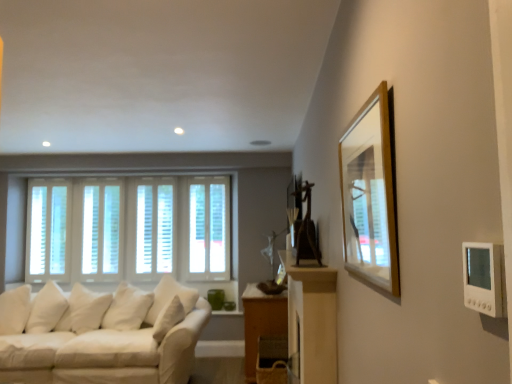
Question: In which direction should I rotate to look at white wood window at center, acting as the 3th window starting from the right?

Choices:
 (A) left
 (B) right

Answer: (A)

Question: Is white fabric couch at lower left touching white wood blinds at center, marked as the second window in a right-to-left arrangement?

Choices:
 (A) no
 (B) yes

Answer: (A)

Question: Is white fabric couch at lower left bigger than white wood blinds at center, placed as the third window when sorted from left to right?

Choices:
 (A) yes
 (B) no

Answer: (A)

Question: Can you confirm if white fabric couch at lower left is smaller than white wood blinds at center, placed as the third window when sorted from left to right?

Choices:
 (A) yes
 (B) no

Answer: (B)

Question: Is white fabric couch at lower left thinner than white wood blinds at center, placed as the third window when sorted from left to right?

Choices:
 (A) no
 (B) yes

Answer: (A)

Question: Considering the relative sizes of white fabric couch at lower left and white wood blinds at center, marked as the second window in a right-to-left arrangement, in the image provided, is white fabric couch at lower left wider than white wood blinds at center, marked as the second window in a right-to-left arrangement,?

Choices:
 (A) yes
 (B) no

Answer: (A)

Question: Would you say white fabric couch at lower left is a long distance from white wood blinds at center, marked as the second window in a right-to-left arrangement?

Choices:
 (A) yes
 (B) no

Answer: (A)

Question: Does white wood blinds at left, positioned as the first window in left-to-right order, appear on the left side of wooden table at lower center?

Choices:
 (A) yes
 (B) no

Answer: (A)

Question: Is white wood blinds at left, positioned as the first window in left-to-right order, further to camera compared to wooden table at lower center?

Choices:
 (A) no
 (B) yes

Answer: (B)

Question: Is white wood blinds at left, positioned as the first window in left-to-right order, aimed at wooden table at lower center?

Choices:
 (A) yes
 (B) no

Answer: (B)

Question: Is the depth of white wood blinds at left, which appears as the 4th window when viewed from the right, less than that of wooden table at lower center?

Choices:
 (A) yes
 (B) no

Answer: (B)

Question: From a real-world perspective, is white wood blinds at left, positioned as the first window in left-to-right order, physically above wooden table at lower center?

Choices:
 (A) no
 (B) yes

Answer: (B)

Question: Is white wood blinds at left, which appears as the 4th window when viewed from the right, oriented away from wooden table at lower center?

Choices:
 (A) yes
 (B) no

Answer: (B)

Question: From the image's perspective, would you say wooden table at lower center is shown under white fabric couch at lower left?

Choices:
 (A) no
 (B) yes

Answer: (A)